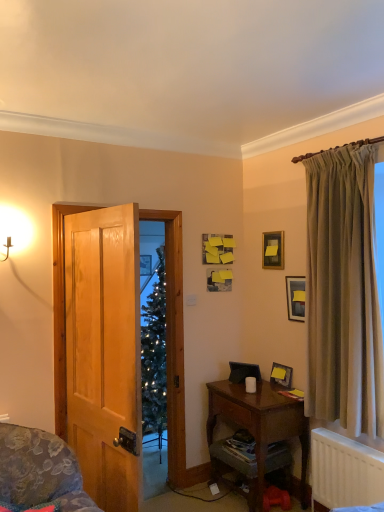
Locate an element on the screen. This screenshot has width=384, height=512. free location to the left of matte black picture frame at lower right, which appears as the 3th picture frame when viewed from the top is located at coordinates (264, 389).